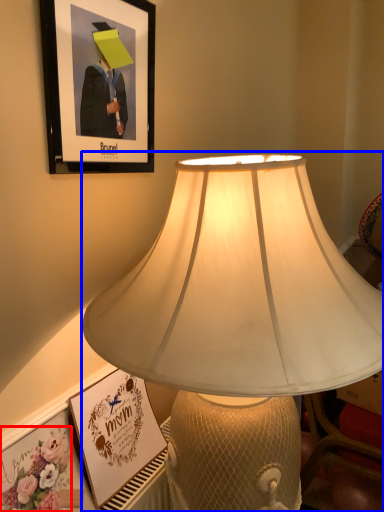
Question: Which object is further to the camera taking this photo, flower (highlighted by a red box) or lamp (highlighted by a blue box)?

Choices:
 (A) flower
 (B) lamp

Answer: (A)